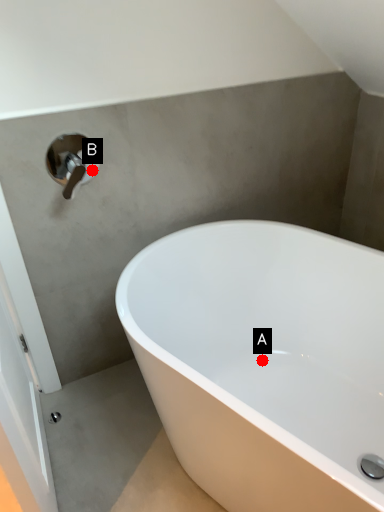
Question: Two points are circled on the image, labeled by A and B beside each circle. Which point is closer to the camera?

Choices:
 (A) A is closer
 (B) B is closer

Answer: (B)